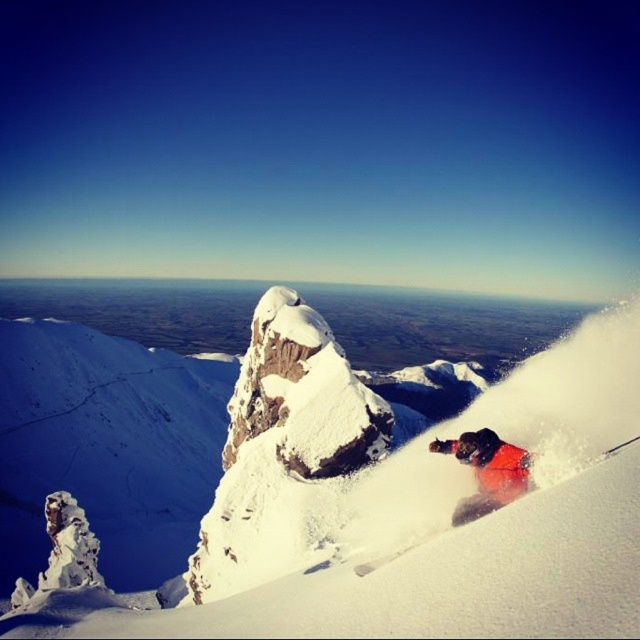
You are a photographer planning to capture the skier in action. The white powdery snow at center and the orange snowsuit at lower right are both in your viewfinder. Based on their positions, which object will appear larger in the photo?

The white powdery snow at center will appear larger in the photo because it is much taller than the orange snowsuit at lower right.

You are a photographer trying to capture the orange snowsuit at lower right and the white powdery snow at center in a single shot. Which object should you focus on first if you want to ensure both are in sharp focus?

The white powdery snow at center is positioned under orange snowsuit at lower right, so focusing on the orange snowsuit at lower right first will help ensure both are in focus since it is closer to the camera.